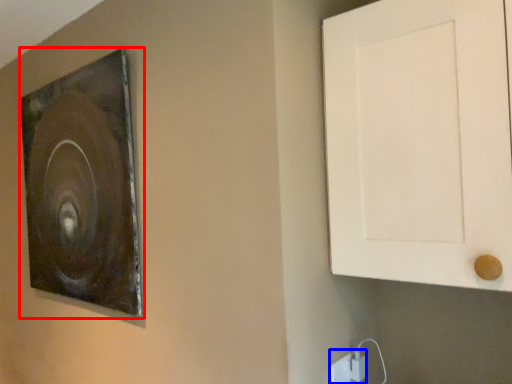
Question: Among these objects, which one is farthest to the camera, picture frame (highlighted by a red box) or electric outlet (highlighted by a blue box)?

Choices:
 (A) picture frame
 (B) electric outlet

Answer: (A)